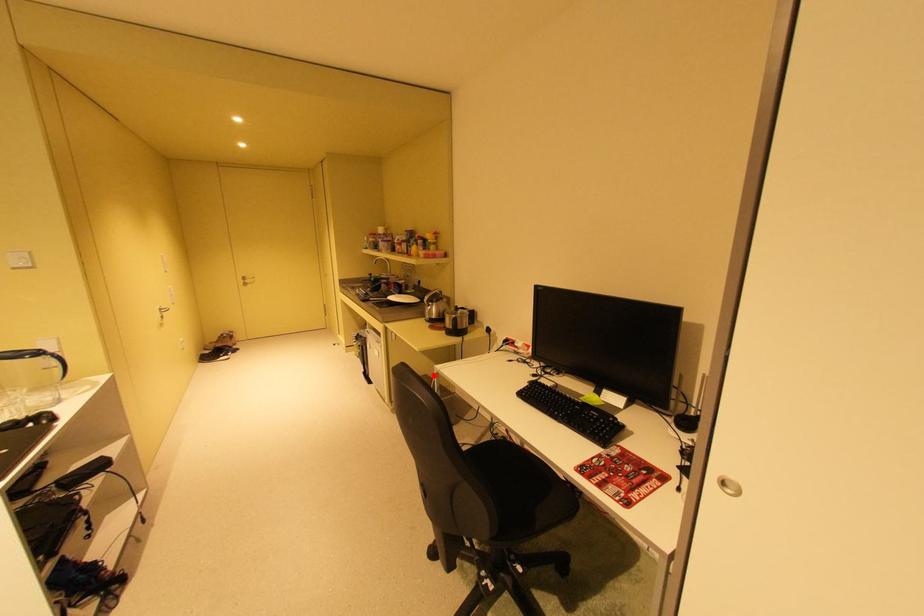
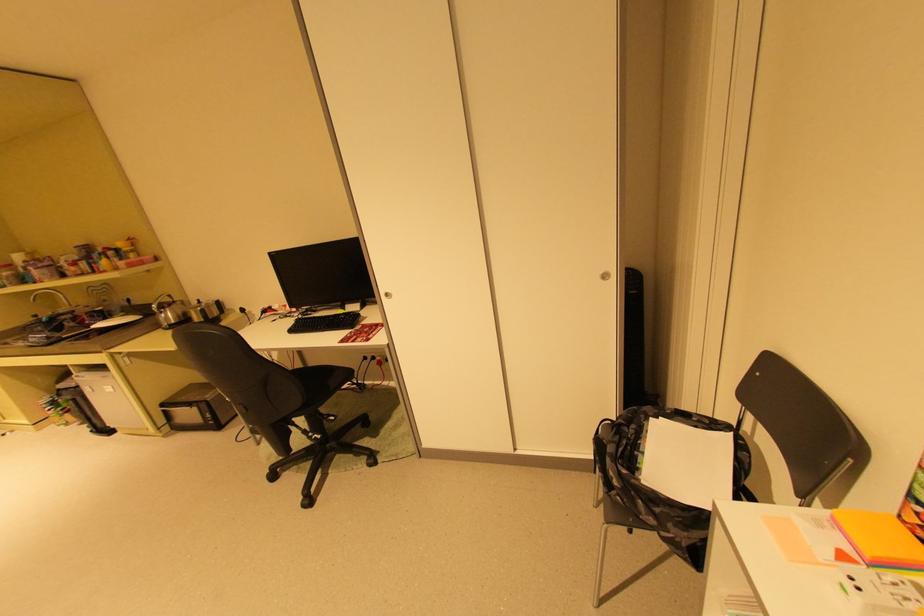
Question: I am providing you with two images of the same scene from different viewpoints. In image1, a red point is highlighted. Considering the same 3D point in image2, which of the following is correct?

Choices:
 (A) It is closer
 (B) It is farther

Answer: (A)